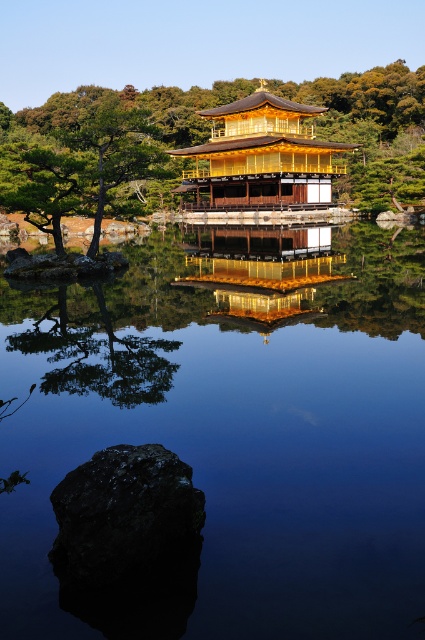
You are a visitor at the Golden Pavilion and want to take a photo of both the green leafy tree at center and the golden polished wood temple at center. Which object will appear larger in your camera viewfinder?

The green leafy tree at center will appear larger in the camera viewfinder because it is taller than the golden polished wood temple at center.

You are a tourist standing at the edge of the water, wanting to take a photo of both the golden polished wood temple at center and the smooth brown tree trunk at upper center in the same frame. Given that your camera has a maximum zoom range of 10 meters, will you be able to capture both objects in a single photo without moving your position?

The distance between the golden polished wood temple at center and the smooth brown tree trunk at upper center is 21.40 meters. Since your camera can only zoom up to 10 meters, you won not be able to capture both objects in a single photo without moving your position.

From the picture: You are a photographer planning to capture the golden polished wood temple at center and the smooth brown tree trunk at upper center in a single shot. Based on their heights, which object should appear shorter in your photo?

The golden polished wood temple at center should appear shorter in the photo because it has a lesser height compared to the smooth brown tree trunk at upper center.